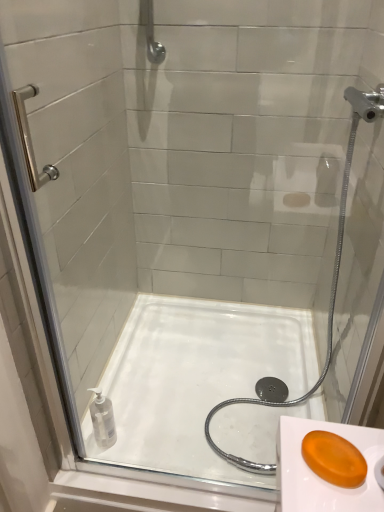
Question: Considering the relative sizes of orange translucent soap at lower right and brushed metal shower handle at upper center in the image provided, is orange translucent soap at lower right bigger than brushed metal shower handle at upper center?

Choices:
 (A) yes
 (B) no

Answer: (B)

Question: Considering the relative sizes of orange translucent soap at lower right and brushed metal shower handle at upper center in the image provided, is orange translucent soap at lower right smaller than brushed metal shower handle at upper center?

Choices:
 (A) yes
 (B) no

Answer: (A)

Question: From a real-world perspective, is orange translucent soap at lower right below brushed metal shower handle at upper center?

Choices:
 (A) no
 (B) yes

Answer: (B)

Question: Does orange translucent soap at lower right have a greater height compared to brushed metal shower handle at upper center?

Choices:
 (A) yes
 (B) no

Answer: (B)

Question: Could you tell me if orange translucent soap at lower right is facing brushed metal shower handle at upper center?

Choices:
 (A) no
 (B) yes

Answer: (A)

Question: From the image's perspective, is orange translucent soap at lower right below brushed metal shower handle at upper center?

Choices:
 (A) no
 (B) yes

Answer: (B)

Question: Can you confirm if white glossy bath at center is positioned to the right of transparent plastic bottle at lower left?

Choices:
 (A) no
 (B) yes

Answer: (B)

Question: Does white glossy bath at center have a larger size compared to transparent plastic bottle at lower left?

Choices:
 (A) no
 (B) yes

Answer: (B)

Question: Is white glossy bath at center closer to the viewer compared to transparent plastic bottle at lower left?

Choices:
 (A) no
 (B) yes

Answer: (B)

Question: Is white glossy bath at center aimed at transparent plastic bottle at lower left?

Choices:
 (A) yes
 (B) no

Answer: (B)

Question: From the image's perspective, would you say white glossy bath at center is positioned over transparent plastic bottle at lower left?

Choices:
 (A) no
 (B) yes

Answer: (B)

Question: Is white glossy bath at center located outside transparent plastic bottle at lower left?

Choices:
 (A) no
 (B) yes

Answer: (B)

Question: Does transparent plastic bottle at lower left have a greater width compared to white glossy bath at center?

Choices:
 (A) no
 (B) yes

Answer: (A)